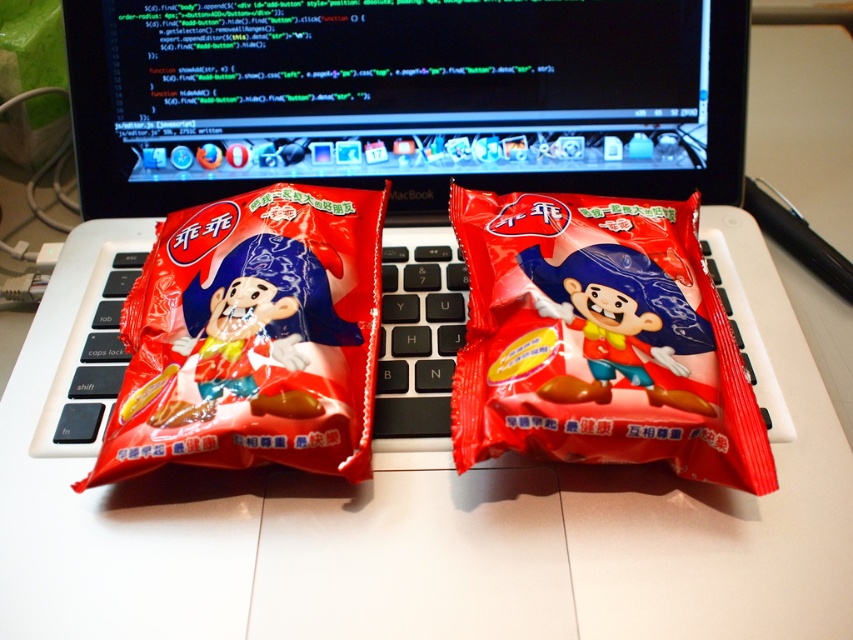
You are a developer working on a JavaScript project and need to reach the keys on your MacBook keyboard. You see the matte plastic snack at center and the matte plastic snack at left blocking your view. Which snack is closer to you, making it easier to move to access the keys?

The matte plastic snack at center is closer to you since the matte plastic snack at left is behind it, so moving the matte plastic snack at center would allow easier access to the keys.

You are a developer working on a JavaScript project and need to place your matte plastic snack at left on the keyboard of your matte black laptop at center. Based on their sizes, will the snack fit entirely on the keyboard without hanging off the edges?

The matte black laptop at center might be wider than matte plastic snack at left, so there is a possibility that the snack will fit on the keyboard. However, since the exact width of the laptop and snack are not provided, it is recommended to check the dimensions before placing the snack to ensure it fits properly.